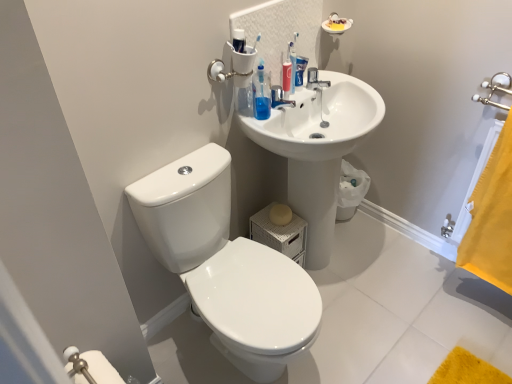
Question: Is white glossy toilet at lower left smaller than white glossy sink at upper right?

Choices:
 (A) yes
 (B) no

Answer: (A)

Question: Does white glossy toilet at lower left have a larger size compared to white glossy sink at upper right?

Choices:
 (A) no
 (B) yes

Answer: (A)

Question: Is white glossy toilet at lower left to the right of white glossy sink at upper right from the viewer's perspective?

Choices:
 (A) yes
 (B) no

Answer: (B)

Question: Is white glossy toilet at lower left behind white glossy sink at upper right?

Choices:
 (A) yes
 (B) no

Answer: (B)

Question: From the image's perspective, is white glossy toilet at lower left located beneath white glossy sink at upper right?

Choices:
 (A) no
 (B) yes

Answer: (B)

Question: Does point (311, 82) appear closer or farther from the camera than point (317, 226)?

Choices:
 (A) farther
 (B) closer

Answer: (B)

Question: Is metallic silver faucet at upper center to the left or to the right of white glossy sink at upper right in the image?

Choices:
 (A) left
 (B) right

Answer: (A)

Question: Would you say metallic silver faucet at upper center is inside or outside white glossy sink at upper right?

Choices:
 (A) inside
 (B) outside

Answer: (A)

Question: From the image's perspective, is metallic silver faucet at upper center positioned above or below white glossy sink at upper right?

Choices:
 (A) above
 (B) below

Answer: (A)

Question: Does point (172, 208) appear closer or farther from the camera than point (314, 84)?

Choices:
 (A) farther
 (B) closer

Answer: (B)

Question: Considering the positions of white glossy toilet at lower left and metallic silver faucet at upper center in the image, is white glossy toilet at lower left wider or thinner than metallic silver faucet at upper center?

Choices:
 (A) thin
 (B) wide

Answer: (B)

Question: In terms of height, does white glossy toilet at lower left look taller or shorter compared to metallic silver faucet at upper center?

Choices:
 (A) tall
 (B) short

Answer: (A)

Question: Relative to metallic silver faucet at upper center, is white glossy toilet at lower left in front or behind?

Choices:
 (A) front
 (B) behind

Answer: (A)

Question: From the image's perspective, is yellow fabric towel at right above or below white glossy sink at upper right?

Choices:
 (A) below
 (B) above

Answer: (A)

Question: Looking at the image, does yellow fabric towel at right seem bigger or smaller compared to white glossy sink at upper right?

Choices:
 (A) small
 (B) big

Answer: (A)